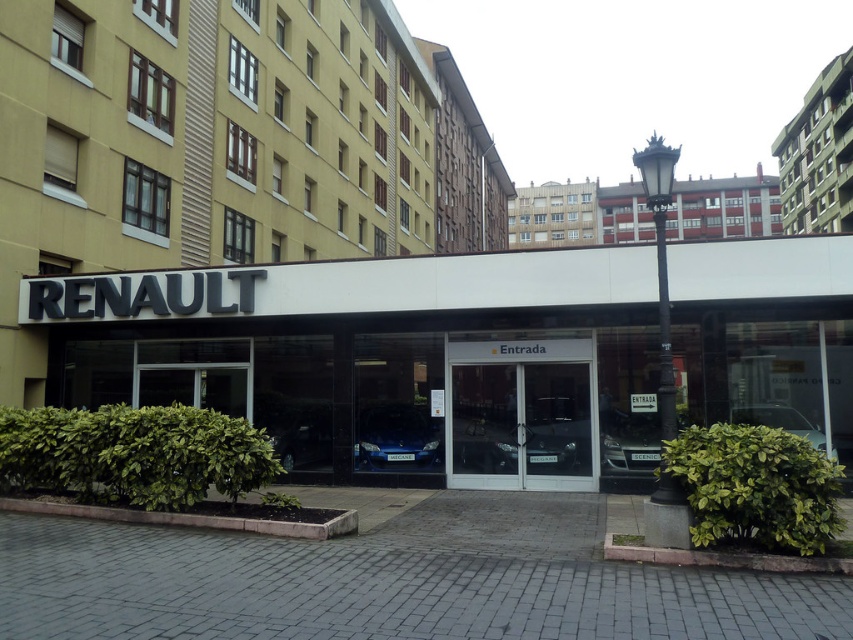
Which is above, transparent glass door at center or concrete building at upper right?

concrete building at upper right is higher up.

Where is `transparent glass door at center`? This screenshot has height=640, width=853. transparent glass door at center is located at coordinates (521, 413).

Does white glossy sign at center have a larger size compared to light brown wooden building at upper center?

Actually, white glossy sign at center might be smaller than light brown wooden building at upper center.

Can you confirm if white glossy sign at center is taller than light brown wooden building at upper center?

No.

Locate an element on the screen. white glossy sign at center is located at coordinates (376, 353).

You are a GUI agent. You are given a task and a screenshot of the screen. Output one action in this format:
    pyautogui.click(x=<x>, y=<y>)
    Task: Click on the white glossy sign at center
    
    Given the screenshot: What is the action you would take?
    pyautogui.click(x=376, y=353)

Can you confirm if red brick building at upper center is thinner than satin blue car at center?

In fact, red brick building at upper center might be wider than satin blue car at center.

Is red brick building at upper center to the left of satin blue car at center from the viewer's perspective?

No, red brick building at upper center is not to the left of satin blue car at center.

Is point (699, 237) closer to camera compared to point (402, 460)?

No, it is not.

Locate an element on the screen. The image size is (853, 640). red brick building at upper center is located at coordinates (723, 208).